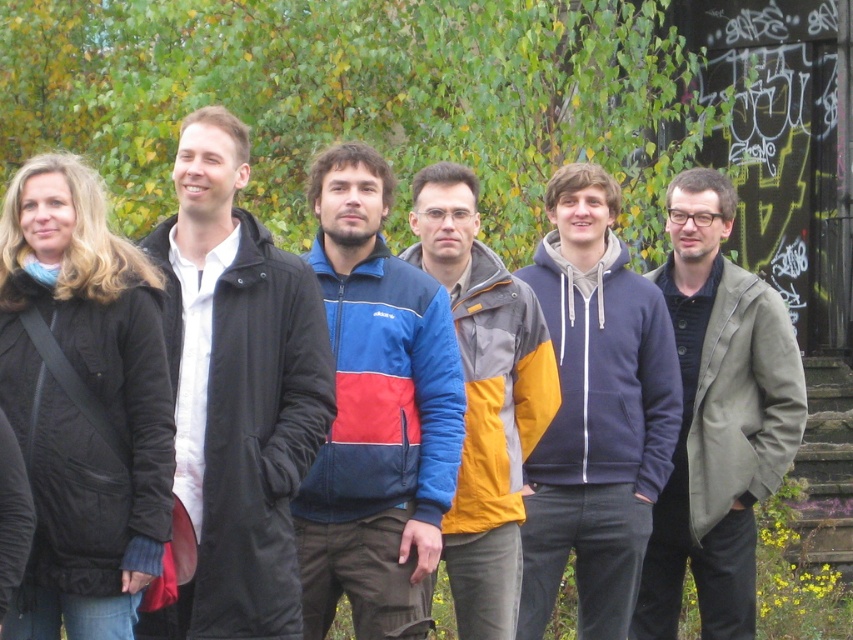
You are standing in the park and see a point marked at coordinates (595,412). According to the scene, which object is this point located on?

The point is located on the navy blue hoodie at center.

You are a photographer trying to capture a group photo of the navy blue hoodie at center and the matte gray coat at right. If your camera has a maximum focus range of 5 meters, will you be able to include both subjects in the same frame without moving closer?

The distance between the navy blue hoodie at center and the matte gray coat at right is 5.05 meters. Since the camera can only focus up to 5 meters, it will be slightly out of range, making it difficult to capture both subjects clearly in the same frame without adjusting your position.